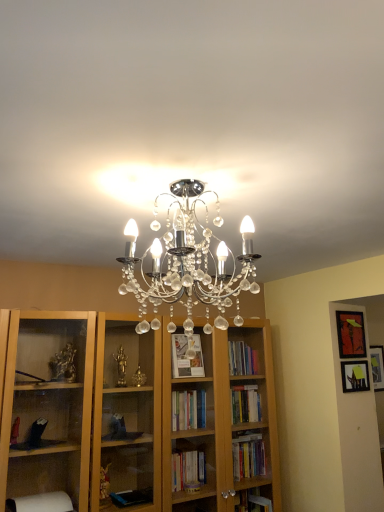
This screenshot has height=512, width=384. Describe the element at coordinates (355, 376) in the screenshot. I see `matte black picture frame at upper right, placed as the 2th picture frame when sorted from top to bottom` at that location.

Based on the photo, in order to face matte black picture frame at upper right, placed as the 2th picture frame when sorted from top to bottom, should I rotate leftwards or rightwards?

You should rotate right by 20.945 degrees.

Looking at this image, how much space does matte black picture frame at upper right, the first picture frame in the bottom-to-top sequence, occupy vertically?

matte black picture frame at upper right, the first picture frame in the bottom-to-top sequence, is 7.60 inches in height.

This screenshot has height=512, width=384. What are the coordinates of `matte black picture frame at upper right, the first picture frame in the bottom-to-top sequence` in the screenshot? It's located at (355, 376).

Image resolution: width=384 pixels, height=512 pixels. What do you see at coordinates (351, 334) in the screenshot? I see `matte black picture frame at upper right, the 1th picture frame in the top-to-bottom sequence` at bounding box center [351, 334].

Identify the location of matte black picture frame at upper right, arranged as the second picture frame when ordered from the bottom. The height and width of the screenshot is (512, 384). (351, 334).

Locate an element on the screen. The width and height of the screenshot is (384, 512). matte black picture frame at upper right, placed as the 2th picture frame when sorted from top to bottom is located at coordinates (355, 376).

Does matte black picture frame at upper right, the 1th picture frame in the top-to-bottom sequence, appear on the left side of matte black picture frame at upper right, placed as the 2th picture frame when sorted from top to bottom?

In fact, matte black picture frame at upper right, the 1th picture frame in the top-to-bottom sequence, is to the right of matte black picture frame at upper right, placed as the 2th picture frame when sorted from top to bottom.

Which object is closer to the camera, matte black picture frame at upper right, arranged as the second picture frame when ordered from the bottom, or matte black picture frame at upper right, placed as the 2th picture frame when sorted from top to bottom?

Positioned in front is matte black picture frame at upper right, placed as the 2th picture frame when sorted from top to bottom.

Is point (360, 321) less distant than point (360, 380)?

That is False.

From the image's perspective, does matte black picture frame at upper right, arranged as the second picture frame when ordered from the bottom, appear higher than matte black picture frame at upper right, the first picture frame in the bottom-to-top sequence?

Yes.

From a real-world perspective, which object stands above the other?

From a 3D spatial view, matte black picture frame at upper right, the 1th picture frame in the top-to-bottom sequence, is above.

Between matte black picture frame at upper right, arranged as the second picture frame when ordered from the bottom, and matte black picture frame at upper right, placed as the 2th picture frame when sorted from top to bottom, which one has larger width?

Wider between the two is matte black picture frame at upper right, arranged as the second picture frame when ordered from the bottom.

Considering the sizes of matte black picture frame at upper right, the 1th picture frame in the top-to-bottom sequence, and matte black picture frame at upper right, placed as the 2th picture frame when sorted from top to bottom, in the image, is matte black picture frame at upper right, the 1th picture frame in the top-to-bottom sequence, taller or shorter than matte black picture frame at upper right, placed as the 2th picture frame when sorted from top to bottom,?

Considering their sizes, matte black picture frame at upper right, the 1th picture frame in the top-to-bottom sequence, has more height than matte black picture frame at upper right, placed as the 2th picture frame when sorted from top to bottom.

In the scene shown: Who is bigger, matte black picture frame at upper right, arranged as the second picture frame when ordered from the bottom, or matte black picture frame at upper right, the first picture frame in the bottom-to-top sequence?

With larger size is matte black picture frame at upper right, arranged as the second picture frame when ordered from the bottom.

Is matte black picture frame at upper right, the 1th picture frame in the top-to-bottom sequence, inside or outside of matte black picture frame at upper right, placed as the 2th picture frame when sorted from top to bottom?

matte black picture frame at upper right, the 1th picture frame in the top-to-bottom sequence, is located beyond the bounds of matte black picture frame at upper right, placed as the 2th picture frame when sorted from top to bottom.

Would you consider matte black picture frame at upper right, the 1th picture frame in the top-to-bottom sequence, to be distant from matte black picture frame at upper right, the first picture frame in the bottom-to-top sequence?

They are positioned close to each other.

Is matte black picture frame at upper right, arranged as the second picture frame when ordered from the bottom, facing away from matte black picture frame at upper right, placed as the 2th picture frame when sorted from top to bottom?

No, matte black picture frame at upper right, arranged as the second picture frame when ordered from the bottom,'s orientation is not away from matte black picture frame at upper right, placed as the 2th picture frame when sorted from top to bottom.

Measure the distance between matte black picture frame at upper right, the 1th picture frame in the top-to-bottom sequence, and matte black picture frame at upper right, the first picture frame in the bottom-to-top sequence.

A distance of 5.98 inches exists between matte black picture frame at upper right, the 1th picture frame in the top-to-bottom sequence, and matte black picture frame at upper right, the first picture frame in the bottom-to-top sequence.

Image resolution: width=384 pixels, height=512 pixels. Identify the location of picture frame on the right of matte black picture frame at upper right, the first picture frame in the bottom-to-top sequence. (351, 334).

Can you confirm if matte black picture frame at upper right, the first picture frame in the bottom-to-top sequence, is positioned to the left of matte black picture frame at upper right, arranged as the second picture frame when ordered from the bottom?

Yes.

In the image, is matte black picture frame at upper right, placed as the 2th picture frame when sorted from top to bottom, positioned in front of or behind matte black picture frame at upper right, arranged as the second picture frame when ordered from the bottom?

matte black picture frame at upper right, placed as the 2th picture frame when sorted from top to bottom, is positioned closer to the viewer than matte black picture frame at upper right, arranged as the second picture frame when ordered from the bottom.

Is point (362, 362) closer or farther from the camera than point (350, 316)?

Point (362, 362).

From the image's perspective, is matte black picture frame at upper right, the first picture frame in the bottom-to-top sequence, located above matte black picture frame at upper right, the 1th picture frame in the top-to-bottom sequence?

No, from the image's perspective, matte black picture frame at upper right, the first picture frame in the bottom-to-top sequence, is not over matte black picture frame at upper right, the 1th picture frame in the top-to-bottom sequence.

From the picture: From a real-world perspective, is matte black picture frame at upper right, placed as the 2th picture frame when sorted from top to bottom, over matte black picture frame at upper right, the 1th picture frame in the top-to-bottom sequence?

No, from a real-world perspective, matte black picture frame at upper right, placed as the 2th picture frame when sorted from top to bottom, is not over matte black picture frame at upper right, the 1th picture frame in the top-to-bottom sequence

Which object is wider, matte black picture frame at upper right, the first picture frame in the bottom-to-top sequence, or matte black picture frame at upper right, arranged as the second picture frame when ordered from the bottom?

Wider between the two is matte black picture frame at upper right, arranged as the second picture frame when ordered from the bottom.

Considering the relative sizes of matte black picture frame at upper right, the first picture frame in the bottom-to-top sequence, and matte black picture frame at upper right, the 1th picture frame in the top-to-bottom sequence, in the image provided, is matte black picture frame at upper right, the first picture frame in the bottom-to-top sequence, taller than matte black picture frame at upper right, the 1th picture frame in the top-to-bottom sequence,?

No, matte black picture frame at upper right, the first picture frame in the bottom-to-top sequence, is not taller than matte black picture frame at upper right, the 1th picture frame in the top-to-bottom sequence.

Considering the relative sizes of matte black picture frame at upper right, placed as the 2th picture frame when sorted from top to bottom, and matte black picture frame at upper right, the 1th picture frame in the top-to-bottom sequence, in the image provided, is matte black picture frame at upper right, placed as the 2th picture frame when sorted from top to bottom, bigger than matte black picture frame at upper right, the 1th picture frame in the top-to-bottom sequence,?

No.

Is matte black picture frame at upper right, the first picture frame in the bottom-to-top sequence, inside the boundaries of matte black picture frame at upper right, the 1th picture frame in the top-to-bottom sequence, or outside?

matte black picture frame at upper right, the first picture frame in the bottom-to-top sequence, is located beyond the bounds of matte black picture frame at upper right, the 1th picture frame in the top-to-bottom sequence.

Is matte black picture frame at upper right, placed as the 2th picture frame when sorted from top to bottom, beside matte black picture frame at upper right, arranged as the second picture frame when ordered from the bottom?

There is a gap between matte black picture frame at upper right, placed as the 2th picture frame when sorted from top to bottom, and matte black picture frame at upper right, arranged as the second picture frame when ordered from the bottom.

Is matte black picture frame at upper right, the first picture frame in the bottom-to-top sequence, oriented towards matte black picture frame at upper right, the 1th picture frame in the top-to-bottom sequence?

No, matte black picture frame at upper right, the first picture frame in the bottom-to-top sequence, is not facing towards matte black picture frame at upper right, the 1th picture frame in the top-to-bottom sequence.

How many degrees apart are the facing directions of matte black picture frame at upper right, placed as the 2th picture frame when sorted from top to bottom, and matte black picture frame at upper right, the 1th picture frame in the top-to-bottom sequence?

They differ by 0.0416 degrees in their facing directions.

Consider the image. Measure the distance from matte black picture frame at upper right, the first picture frame in the bottom-to-top sequence, to matte black picture frame at upper right, arranged as the second picture frame when ordered from the bottom.

15.19 centimeters.

The width and height of the screenshot is (384, 512). Identify the location of picture frame above the matte black picture frame at upper right, the first picture frame in the bottom-to-top sequence (from the image's perspective). (351, 334).

The image size is (384, 512). Identify the location of picture frame positioned vertically above the matte black picture frame at upper right, placed as the 2th picture frame when sorted from top to bottom (from a real-world perspective). (351, 334).

This screenshot has width=384, height=512. Identify the location of picture frame to the left of matte black picture frame at upper right, the 1th picture frame in the top-to-bottom sequence. (355, 376).